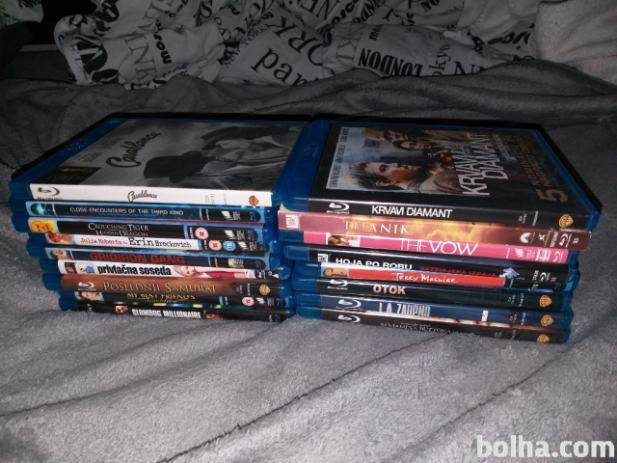
Image resolution: width=617 pixels, height=463 pixels. What are the coordinates of `dvds in left stack` in the screenshot? It's located at (165, 194), (155, 208), (157, 229), (141, 242), (170, 260), (152, 267), (149, 285), (166, 300), (174, 313).